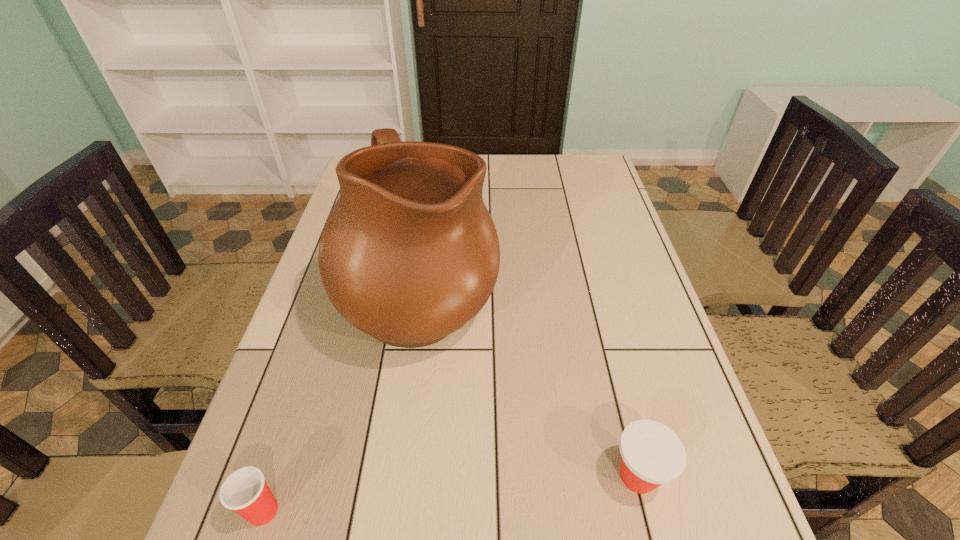
The image size is (960, 540). Identify the location of the farthest object. (409, 254).

You are a GUI agent. You are given a task and a screenshot of the screen. Output one action in this format:
    pyautogui.click(x=<x>, y=<y>)
    Task: Click on the tallest object
    
    Given the screenshot: What is the action you would take?
    pyautogui.click(x=409, y=254)

Where is `the rightmost object`? Image resolution: width=960 pixels, height=540 pixels. the rightmost object is located at coordinates (652, 454).

The height and width of the screenshot is (540, 960). In order to click on the left Dixie cup in this screenshot , I will do `click(245, 491)`.

You are a GUI agent. You are given a task and a screenshot of the screen. Output one action in this format:
    pyautogui.click(x=<x>, y=<y>)
    Task: Click on the vacant region located 0.060m at the spout of the tallest object
    The height and width of the screenshot is (540, 960).
    Given the screenshot: What is the action you would take?
    pyautogui.click(x=520, y=295)

The height and width of the screenshot is (540, 960). Find the location of `free spot located on the left of the rightmost object`. free spot located on the left of the rightmost object is located at coordinates (470, 476).

Where is `free space located on the right of the left Dixie cup`? This screenshot has height=540, width=960. free space located on the right of the left Dixie cup is located at coordinates (312, 511).

The height and width of the screenshot is (540, 960). In order to click on cream pitcher located in the left edge section of the desktop in this screenshot , I will do `click(409, 254)`.

This screenshot has height=540, width=960. In order to click on Dixie cup located in the left edge section of the desktop in this screenshot , I will do `click(245, 491)`.

The height and width of the screenshot is (540, 960). Identify the location of object located in the right edge section of the desktop. (652, 454).